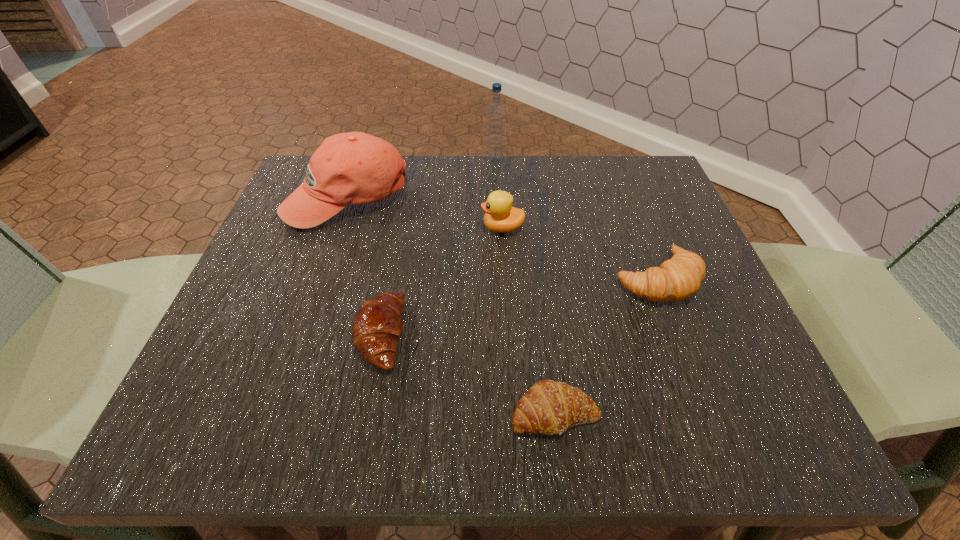
I want to click on free space between the rightmost crescent roll and the nearest crescent roll, so click(x=606, y=346).

Identify the location of vacant area between the second crescent roll from right to left and the leftmost crescent roll. (468, 374).

Where is `free point between the nearest crescent roll and the baseball cap`? This screenshot has height=540, width=960. free point between the nearest crescent roll and the baseball cap is located at coordinates (451, 306).

Locate an element on the screen. The width and height of the screenshot is (960, 540). unoccupied position between the rightmost object and the second tallest object is located at coordinates (502, 239).

What are the coordinates of `free space between the duckling and the nearest object` in the screenshot? It's located at (529, 321).

The height and width of the screenshot is (540, 960). Find the location of `vacant space that is in between the farthest object and the third shortest object`. vacant space that is in between the farthest object and the third shortest object is located at coordinates (576, 219).

Locate which object is the fourth closest to the nearest object. Please provide its 2D coordinates. Your answer should be formatted as a tuple, i.e. [(x, y)], where the tuple contains the x and y coordinates of a point satisfying the conditions above.

[(348, 168)]

What are the coordinates of `object that is the second nearest to the fourth shortest object` in the screenshot? It's located at (348, 168).

Select which crescent roll appears as the second closest to the second crescent roll from left to right. Please provide its 2D coordinates. Your answer should be formatted as a tuple, i.e. [(x, y)], where the tuple contains the x and y coordinates of a point satisfying the conditions above.

[(678, 278)]

This screenshot has width=960, height=540. Identify the location of crescent roll identified as the second closest to the water bottle. (377, 326).